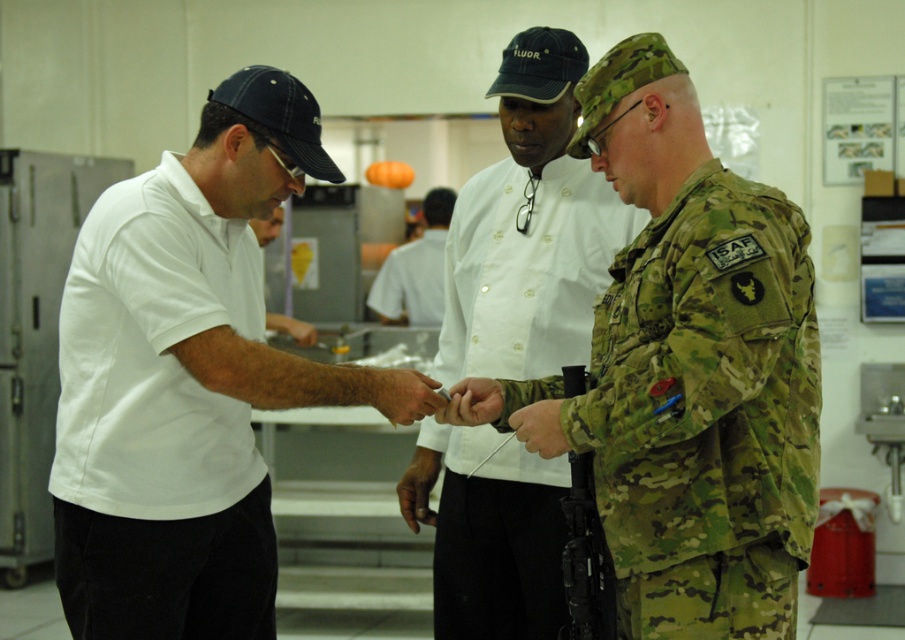
You are standing in the kitchen and need to hand a tool to both the person wearing the white matte shirt at left and the camouflage fabric at center. Which person should you approach first to ensure you can reach them without moving closer?

You should approach the white matte shirt at left first because it is closer to you than the camouflage fabric at center, so you can reach them without needing to move closer.

You are a food delivery person who needs to locate the chef in the kitchen. Which person should you approach first, the white cotton shirt at left or the camo fabric uniform at center?

The white cotton shirt at left is in front of the camo fabric uniform at center, so you should approach the camo fabric uniform at center first because they are closer to you.